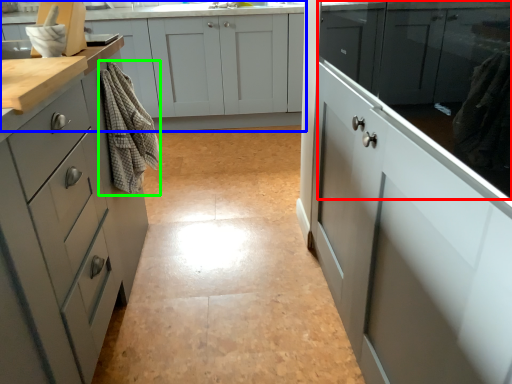
Question: Based on their relative distances, which object is farther from cabinetry (highlighted by a red box)? Choose from cabinetry (highlighted by a blue box) and material (highlighted by a green box).

Choices:
 (A) cabinetry
 (B) material

Answer: (A)